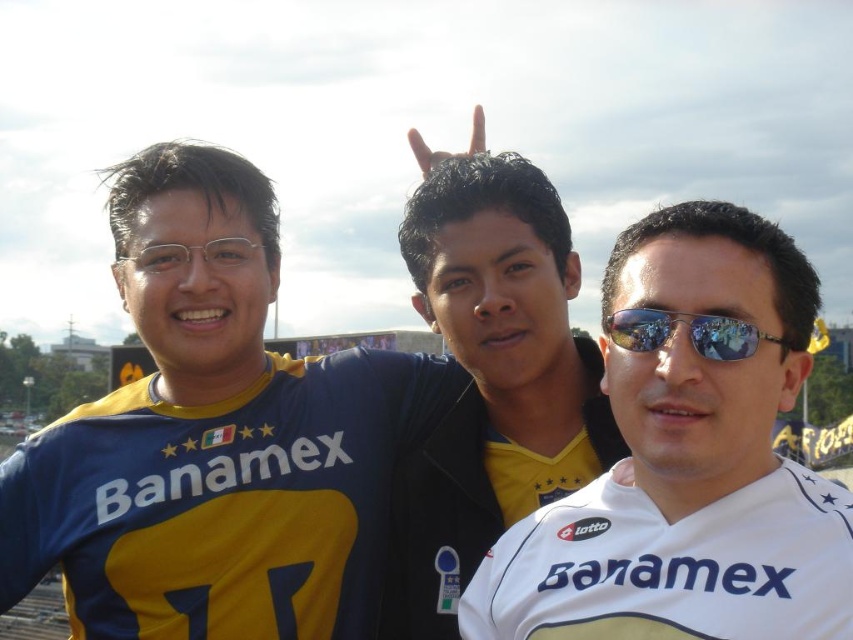
Question: Which of the following is the farthest from the observer?

Choices:
 (A) yellow jersey at center
 (B) blue jersey at left

Answer: (A)

Question: Is blue jersey at left in front of white matte jersey at center?

Choices:
 (A) no
 (B) yes

Answer: (A)

Question: Considering the relative positions of blue jersey at left and white matte jersey at center in the image provided, where is blue jersey at left located with respect to white matte jersey at center?

Choices:
 (A) above
 (B) below

Answer: (A)

Question: Estimate the real-world distances between objects in this image. Which object is closer to the yellow jersey at center?

Choices:
 (A) sunglasses at center
 (B) blue jersey at left
 (C) white matte jersey at center

Answer: (B)

Question: Among these points, which one is nearest to the camera?

Choices:
 (A) (409, 442)
 (B) (759, 337)
 (C) (724, 536)
 (D) (461, 232)

Answer: (C)

Question: Is blue jersey at left in front of sunglasses at center?

Choices:
 (A) yes
 (B) no

Answer: (B)